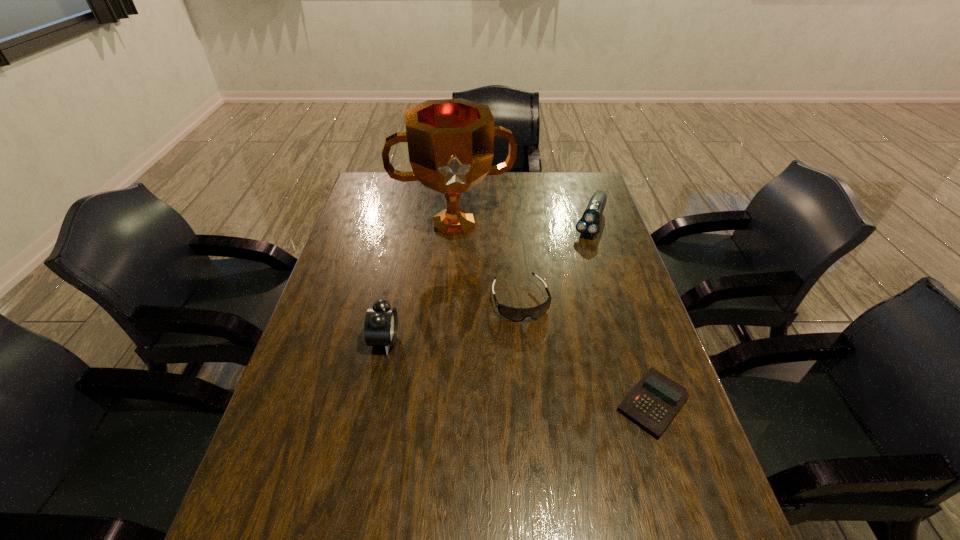
The height and width of the screenshot is (540, 960). What are the coordinates of `vacant area that lies between the electric shaver and the tallest object` in the screenshot? It's located at (522, 223).

Identify the location of free point between the electric shaver and the third nearest object. (555, 261).

The image size is (960, 540). In order to click on object identified as the second closest to the third nearest object in this screenshot , I will do `click(654, 401)`.

Identify which object is the second closest to the third shortest object. Please provide its 2D coordinates. Your answer should be formatted as a tuple, i.e. [(x, y)], where the tuple contains the x and y coordinates of a point satisfying the conditions above.

[(515, 314)]

You are a GUI agent. You are given a task and a screenshot of the screen. Output one action in this format:
    pyautogui.click(x=<x>, y=<y>)
    Task: Click on the vacant area in the image that satisfies the following two spatial constraints: 1. on the back side of the award; 2. on the right side of the electric shaver
    Image resolution: width=960 pixels, height=540 pixels.
    Given the screenshot: What is the action you would take?
    pyautogui.click(x=454, y=222)

What are the coordinates of `free spot that satisfies the following two spatial constraints: 1. on the front side of the shortest object; 2. on the left side of the goggles` in the screenshot? It's located at (530, 403).